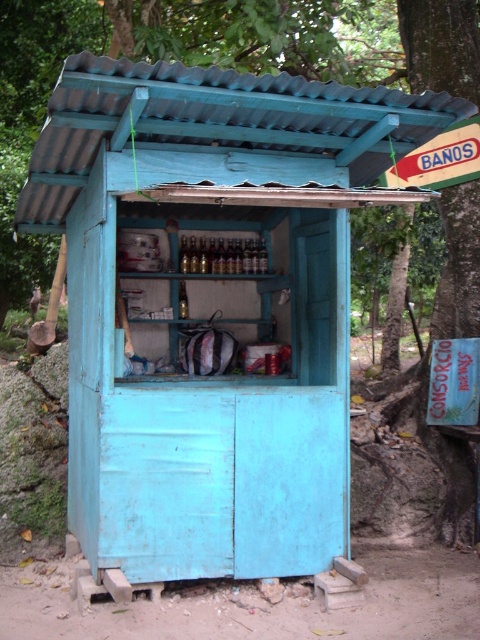
Question: Does translucent glass bottles at center appear on the left side of translucent glass bottle at center?

Choices:
 (A) no
 (B) yes

Answer: (A)

Question: Where is translucent glass bottles at center located in relation to matte plastic bottle at center in the image?

Choices:
 (A) left
 (B) right

Answer: (B)

Question: Which point is farther to the camera?

Choices:
 (A) (216, 243)
 (B) (189, 268)

Answer: (A)

Question: Which point is closer to the camera?

Choices:
 (A) (179, 294)
 (B) (199, 269)
 (C) (181, 268)

Answer: (B)

Question: Is translucent glass bottles at center above translucent glass bottle at center?

Choices:
 (A) yes
 (B) no

Answer: (B)

Question: Which of the following is the closest to the observer?

Choices:
 (A) translucent glass bottles at center
 (B) matte plastic bottle at center
 (C) translucent glass bottle at center

Answer: (C)